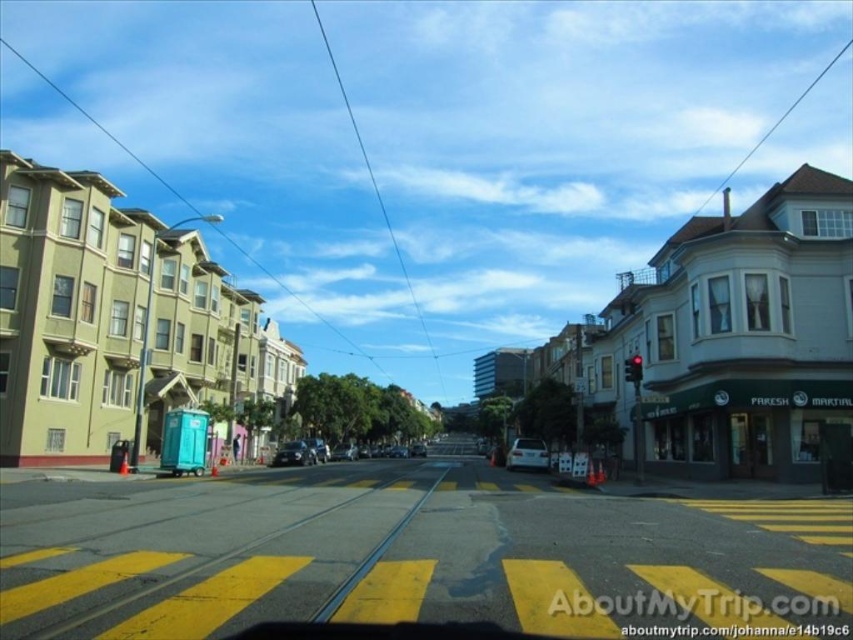
You are a pedestrian standing at the crosswalk on the yellow crosswalk stripes. You see the yellow asphalt at center and the white matte car at center. Which object is closer to your left side?

The yellow asphalt at center is to the left of white matte car at center, so the yellow asphalt at center is closer to your left side.